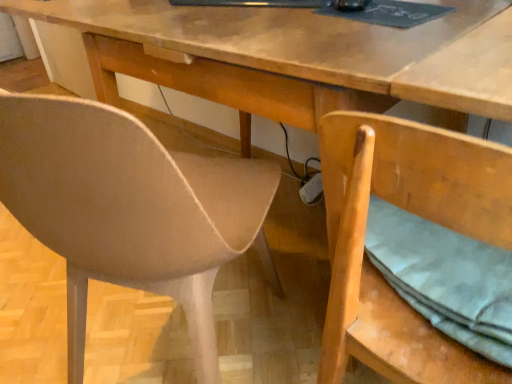
Question: From a real-world perspective, is wooden chair at lower right, which is counted as the 1th chair, starting from the right, physically above matte beige chair at left, arranged as the 1th chair when viewed from the left?

Choices:
 (A) no
 (B) yes

Answer: (B)

Question: Is wooden chair at lower right, arranged as the second chair when viewed from the left, next to matte beige chair at left, which is counted as the 2th chair, starting from the right, and touching it?

Choices:
 (A) no
 (B) yes

Answer: (A)

Question: Can you confirm if wooden chair at lower right, which is counted as the 1th chair, starting from the right, is thinner than matte beige chair at left, which is counted as the 2th chair, starting from the right?

Choices:
 (A) yes
 (B) no

Answer: (A)

Question: Does wooden chair at lower right, which is counted as the 1th chair, starting from the right, appear on the right side of matte beige chair at left, arranged as the 1th chair when viewed from the left?

Choices:
 (A) yes
 (B) no

Answer: (A)

Question: Is wooden chair at lower right, which is counted as the 1th chair, starting from the right, outside of matte beige chair at left, arranged as the 1th chair when viewed from the left?

Choices:
 (A) no
 (B) yes

Answer: (B)

Question: Is wooden chair at lower right, which is counted as the 1th chair, starting from the right, positioned in front of matte beige chair at left, which is counted as the 2th chair, starting from the right?

Choices:
 (A) yes
 (B) no

Answer: (B)

Question: Is matte beige chair at left, which is counted as the 2th chair, starting from the right, smaller than wooden chair at lower right, arranged as the second chair when viewed from the left?

Choices:
 (A) no
 (B) yes

Answer: (A)

Question: From a real-world perspective, does matte beige chair at left, arranged as the 1th chair when viewed from the left, sit lower than wooden chair at lower right, which is counted as the 1th chair, starting from the right?

Choices:
 (A) no
 (B) yes

Answer: (B)

Question: Is matte beige chair at left, which is counted as the 2th chair, starting from the right, positioned before wooden chair at lower right, which is counted as the 1th chair, starting from the right?

Choices:
 (A) no
 (B) yes

Answer: (B)

Question: Is matte beige chair at left, which is counted as the 2th chair, starting from the right, with wooden chair at lower right, arranged as the second chair when viewed from the left?

Choices:
 (A) yes
 (B) no

Answer: (B)

Question: Could wooden chair at lower right, arranged as the second chair when viewed from the left, be considered to be inside matte beige chair at left, arranged as the 1th chair when viewed from the left?

Choices:
 (A) yes
 (B) no

Answer: (B)

Question: From the image's perspective, is matte beige chair at left, which is counted as the 2th chair, starting from the right, beneath wooden chair at lower right, which is counted as the 1th chair, starting from the right?

Choices:
 (A) no
 (B) yes

Answer: (A)

Question: Considering the positions of wooden chair at lower right, which is counted as the 1th chair, starting from the right, and matte beige chair at left, which is counted as the 2th chair, starting from the right, in the image, is wooden chair at lower right, which is counted as the 1th chair, starting from the right, bigger or smaller than matte beige chair at left, which is counted as the 2th chair, starting from the right,?

Choices:
 (A) small
 (B) big

Answer: (A)